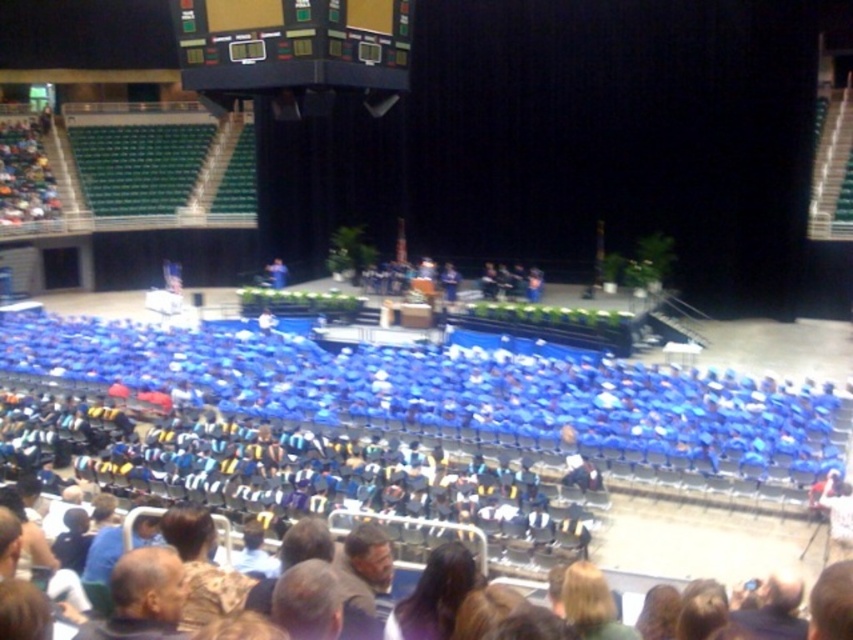
Between black glossy scoreboard at upper center and gray hair at lower left, which one appears on the right side from the viewer's perspective?

From the viewer's perspective, gray hair at lower left appears more on the right side.

Can you confirm if black glossy scoreboard at upper center is wider than gray hair at lower left?

Indeed, black glossy scoreboard at upper center has a greater width compared to gray hair at lower left.

Between point (364, 84) and point (146, 612), which one is positioned behind?

Positioned behind is point (364, 84).

This screenshot has width=853, height=640. Find the location of `black glossy scoreboard at upper center`. black glossy scoreboard at upper center is located at coordinates (292, 44).